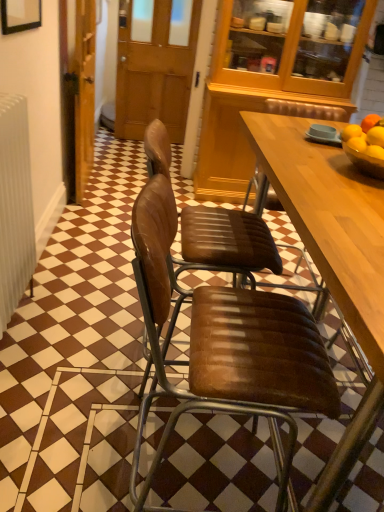
Image resolution: width=384 pixels, height=512 pixels. I want to click on free point below wooden door at left (from a real-world perspective), so click(92, 181).